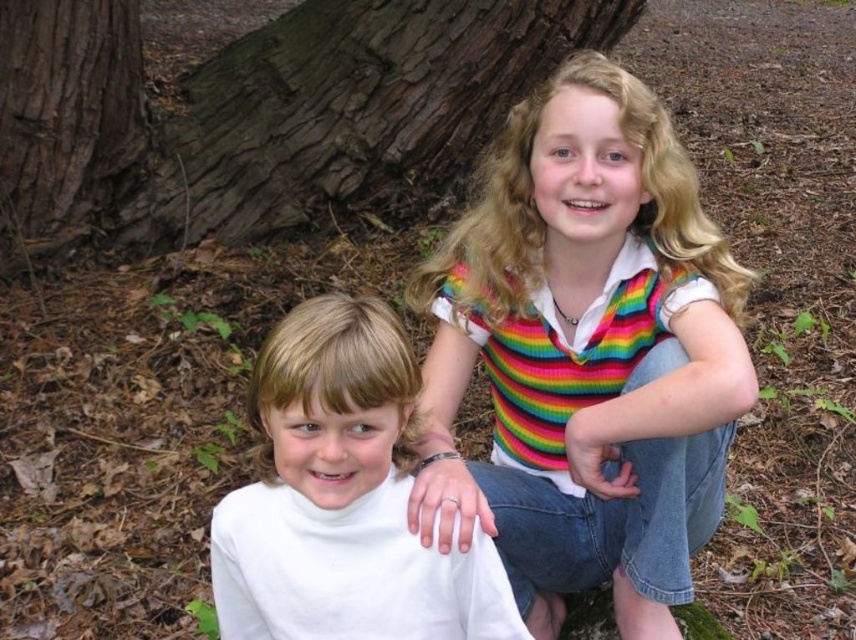
What do you see at coordinates (342, 499) in the screenshot? The height and width of the screenshot is (640, 856). I see `white matte turtleneck shirt at center` at bounding box center [342, 499].

Can you confirm if white matte turtleneck shirt at center is taller than brown rough tree trunk at left?

Incorrect, white matte turtleneck shirt at center's height is not larger of brown rough tree trunk at left's.

Does point (399, 333) come in front of point (39, 193)?

Yes, it is in front of point (39, 193).

Locate an element on the screen. The width and height of the screenshot is (856, 640). white matte turtleneck shirt at center is located at coordinates (342, 499).

Is dark brown textured bark at upper left taller than white matte turtleneck shirt at center?

Yes, dark brown textured bark at upper left is taller than white matte turtleneck shirt at center.

Which is in front, point (0, 232) or point (331, 561)?

Point (331, 561)

The height and width of the screenshot is (640, 856). What are the coordinates of `dark brown textured bark at upper left` in the screenshot? It's located at (259, 109).

Find the location of a particular element. The image size is (856, 640). dark brown textured bark at upper left is located at coordinates (259, 109).

Can you confirm if rainbow knitted sweater at center is wider than white matte turtleneck shirt at center?

Yes.

Which is in front, point (673, 209) or point (256, 488)?

Point (256, 488) is in front.

The width and height of the screenshot is (856, 640). Identify the location of rainbow knitted sweater at center. (586, 355).